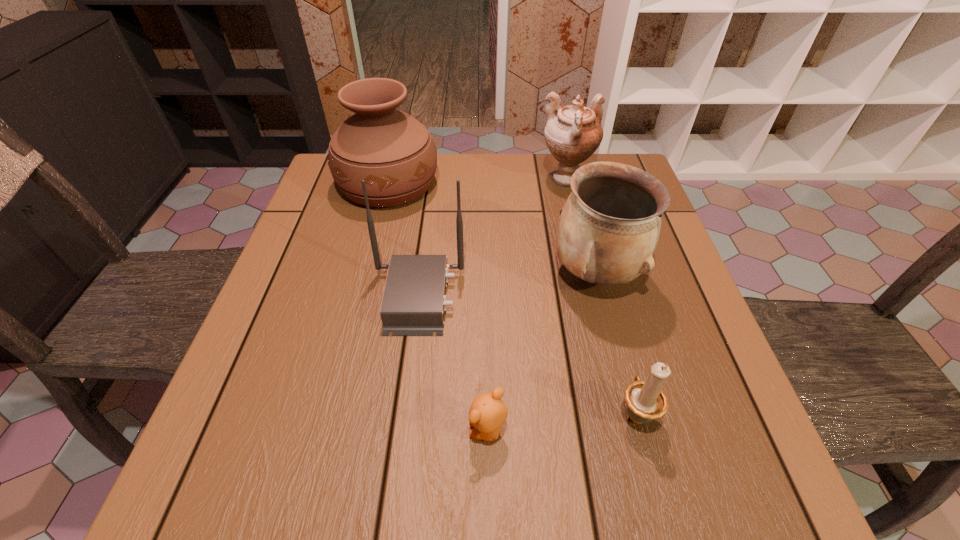
Where is `vacant space at the near edge of the desktop`? This screenshot has width=960, height=540. vacant space at the near edge of the desktop is located at coordinates (x=633, y=495).

Where is `free space at the left edge`? free space at the left edge is located at coordinates (271, 328).

Image resolution: width=960 pixels, height=540 pixels. I want to click on vacant area at the right edge of the desktop, so click(x=682, y=333).

I want to click on blank space at the near left corner of the desktop, so click(253, 501).

In the image, there is a desktop. At what (x,y) coordinates should I click in order to perform the action: click on free space at the far right corner. Please return your answer as a coordinate pair (x, y). This screenshot has height=540, width=960. Looking at the image, I should click on (x=597, y=160).

What are the coordinates of `vacant space at the near right corner` in the screenshot? It's located at (754, 497).

You are a GUI agent. You are given a task and a screenshot of the screen. Output one action in this format:
    pyautogui.click(x=<x>, y=<y>)
    Task: Click on the empty space that is in between the router and the second shortest object
    The height and width of the screenshot is (540, 960).
    Given the screenshot: What is the action you would take?
    pyautogui.click(x=527, y=355)

The height and width of the screenshot is (540, 960). In order to click on free space that is in between the nearest urn and the router in this screenshot , I will do `click(507, 285)`.

The image size is (960, 540). Identify the location of vacant region between the nearest urn and the router. (507, 285).

Locate an element on the screen. This screenshot has width=960, height=540. free space that is in between the nearest urn and the second shortest object is located at coordinates (616, 343).